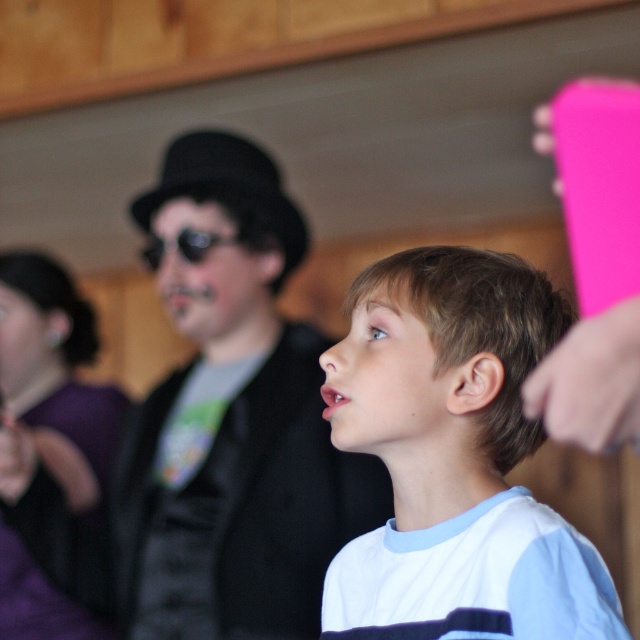
Question: Does black matte hat at center have a smaller size compared to black reflective sunglasses at center?

Choices:
 (A) no
 (B) yes

Answer: (A)

Question: Can you confirm if white matte shirt at center is positioned below black reflective sunglasses at center?

Choices:
 (A) yes
 (B) no

Answer: (A)

Question: Which object is closer to the camera taking this photo?

Choices:
 (A) white matte shirt at center
 (B) black reflective sunglasses at center
 (C) black matte hat at center

Answer: (A)

Question: Among these points, which one is farthest from the camera?

Choices:
 (A) (516, 634)
 (B) (237, 236)

Answer: (B)

Question: Which of the following is the closest to the observer?

Choices:
 (A) white matte shirt at center
 (B) black reflective sunglasses at center
 (C) black matte hat at center

Answer: (A)

Question: Can you confirm if black matte hat at center is thinner than black reflective sunglasses at center?

Choices:
 (A) no
 (B) yes

Answer: (A)